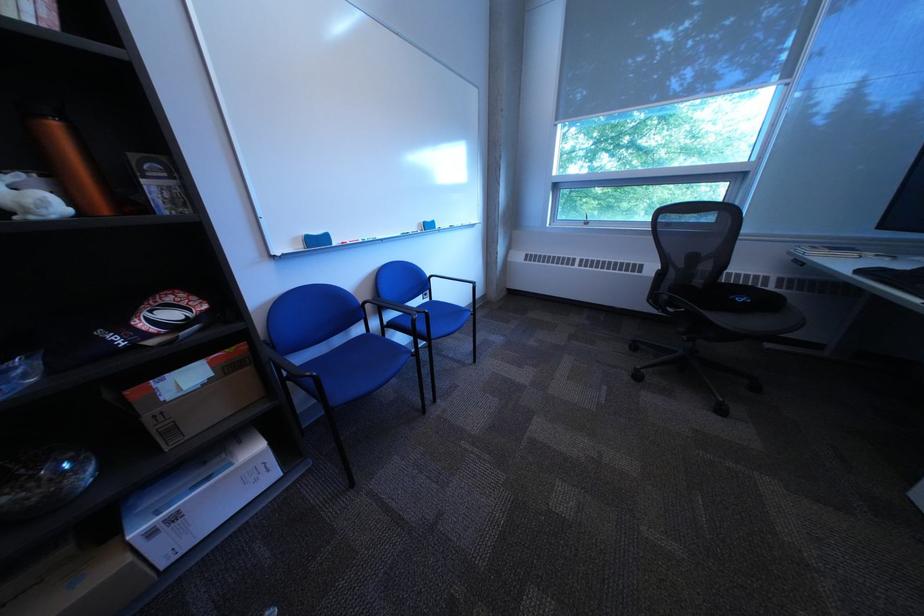
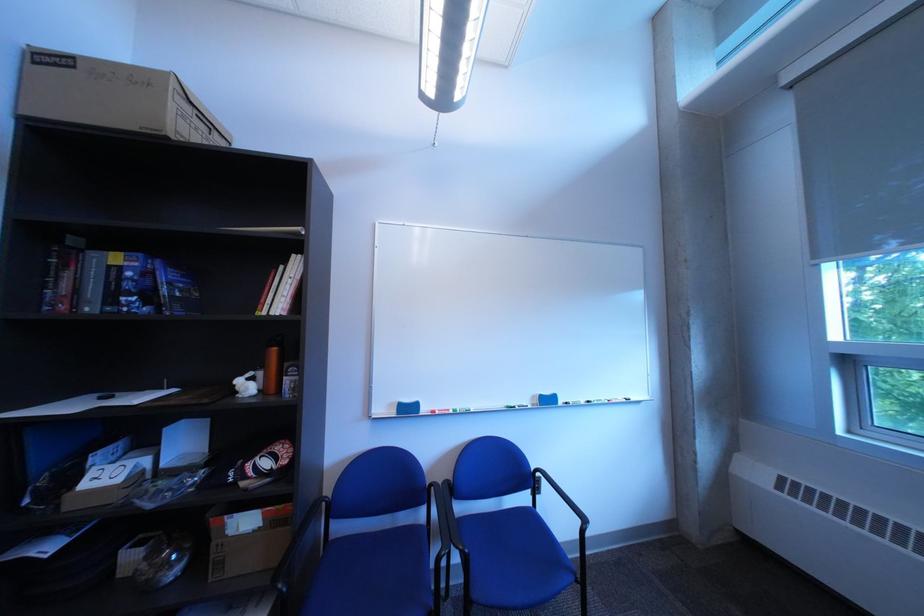
In the second image, find the point that corresponds to point (190, 430) in the first image.

(237, 565)